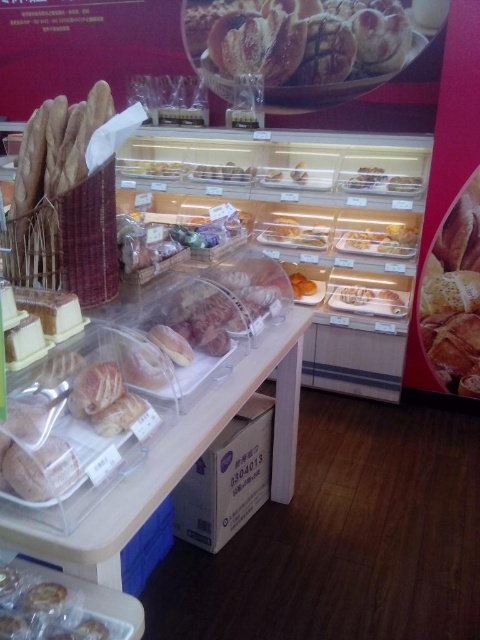
Which of these two, matte brown bread at right or translucent plastic pastries at lower left, stands taller?

With more height is matte brown bread at right.

Which is behind, point (447, 278) or point (45, 589)?

Positioned behind is point (447, 278).

Locate an element on the screen. This screenshot has width=480, height=640. matte brown bread at right is located at coordinates (454, 296).

Between golden brown flaky pastry at upper center and matte brown bread at right, which one is positioned higher?

golden brown flaky pastry at upper center is above.

Find the location of a particular element. Image resolution: width=480 pixels, height=640 pixels. golden brown flaky pastry at upper center is located at coordinates (298, 38).

Does point (357, 42) come in front of point (471, 369)?

Yes, point (357, 42) is in front of point (471, 369).

Find the location of a particular element. golden brown flaky pastry at upper center is located at coordinates coord(298,38).

How much distance is there between golden brown flaky pastry at upper center and translucent plastic pastries at lower left?

golden brown flaky pastry at upper center and translucent plastic pastries at lower left are 9.05 feet apart.

Which of these two, golden brown flaky pastry at upper center or translucent plastic pastries at lower left, stands taller?

golden brown flaky pastry at upper center

Between point (275, 40) and point (9, 620), which one is positioned in front?

Point (9, 620) is in front.

Locate an element on the screen. This screenshot has height=640, width=480. golden brown flaky pastry at upper center is located at coordinates (298, 38).